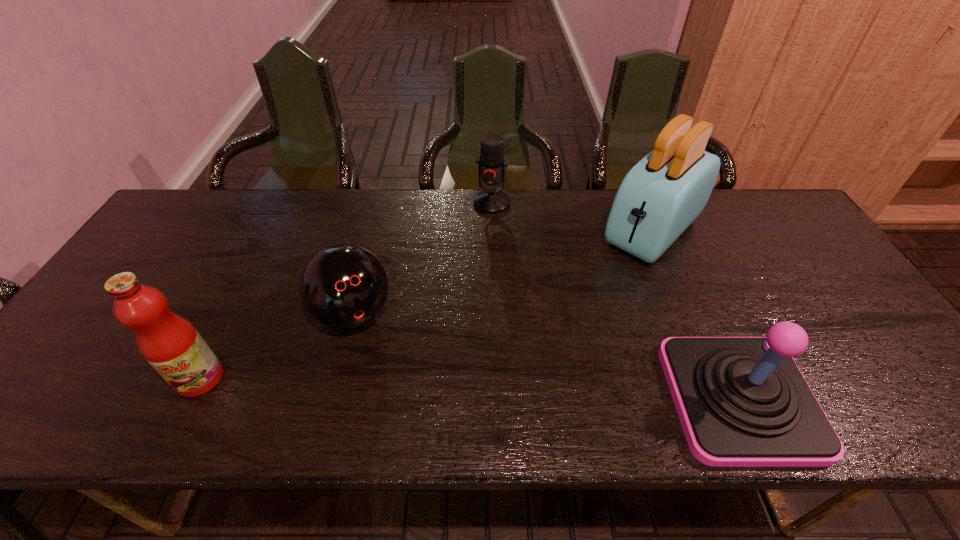
The image size is (960, 540). I want to click on free space on the desktop that is between the fruit juice and the joystick and is positioned on the side of the third object from right to left with the red ring, so click(x=422, y=387).

Locate an element on the screen. This screenshot has height=540, width=960. vacant spot on the desktop that is between the fruit juice and the joystick and is positioned on the surface of the bowling ball near the finger holes is located at coordinates (388, 386).

Where is `vacant space on the desktop that is between the leftmost object and the joystick and is positioned on the side of the toaster with the lever`? vacant space on the desktop that is between the leftmost object and the joystick and is positioned on the side of the toaster with the lever is located at coordinates (492, 389).